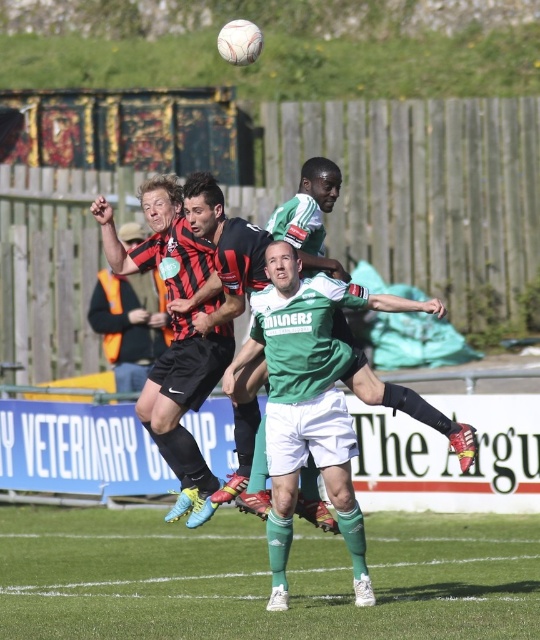
You are a soccer coach analyzing the match. The ball is at point with coordinates [262,577]. Where is the ball located on the field?

The ball is located on the green grass at center, as the point with coordinates [262,577] is on green grass at center.

In the scene shown: You are a soccer coach analyzing the match. You notice the green grass at center and the white matte soccer player at center. Which one is wider in the image?

The green grass at center is wider than the white matte soccer player at center according to the description provided.